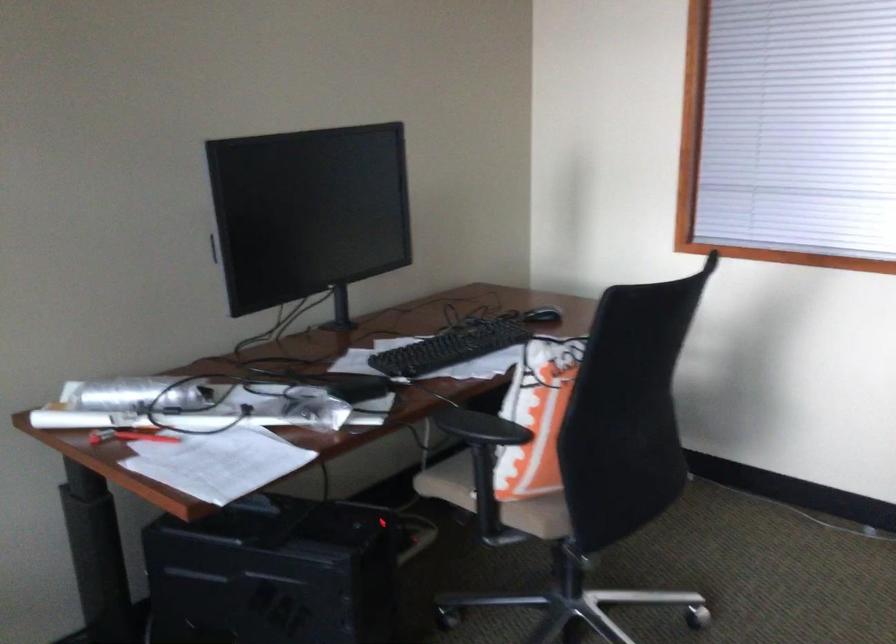
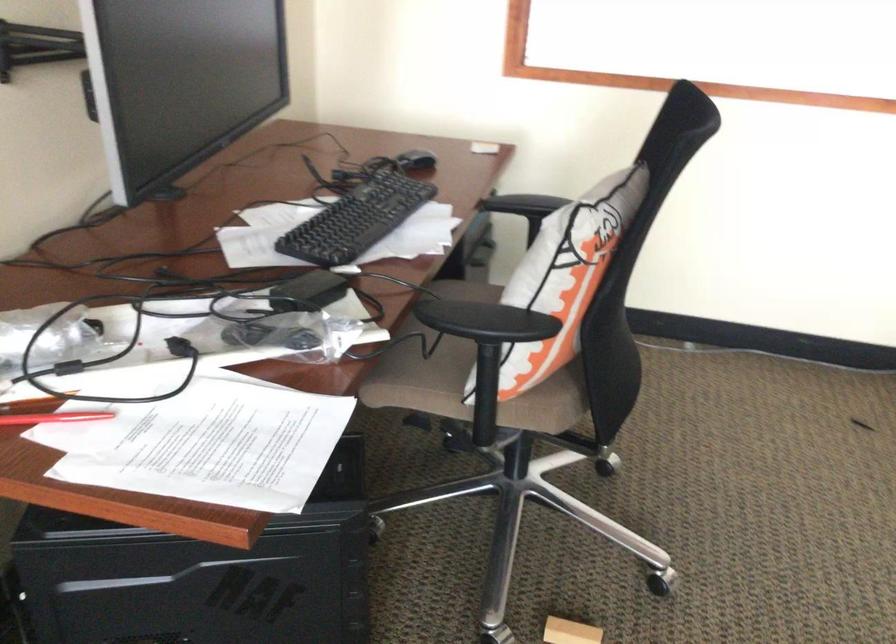
In the second image, find the point that corresponds to (528,395) in the first image.

(564, 277)